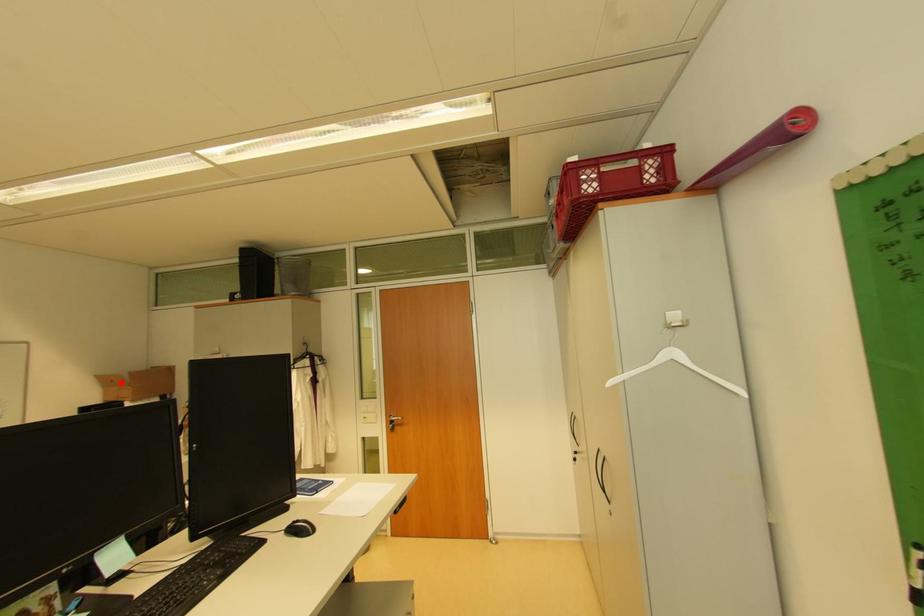
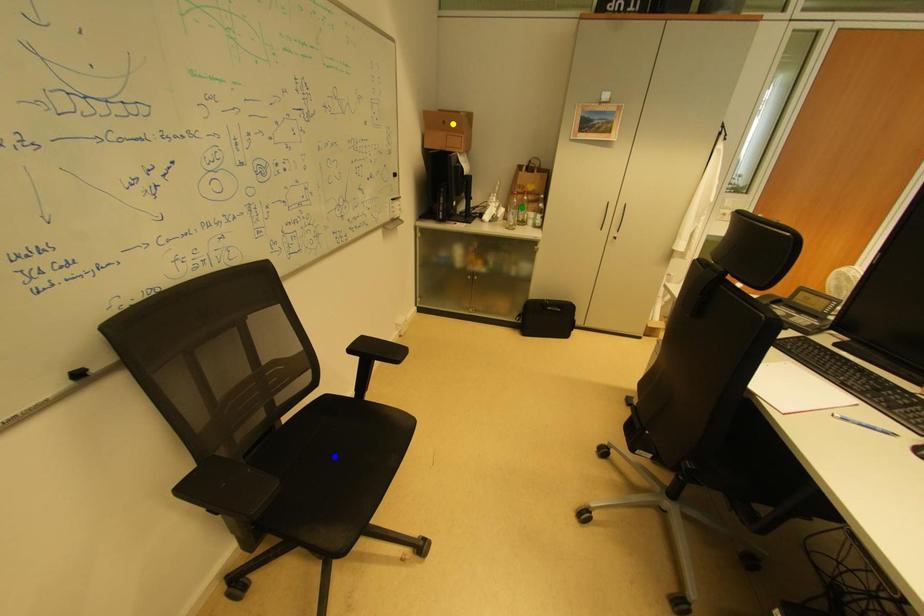
Question: I am providing you with two images of the same scene from different viewpoints. A red point is marked on the first image. You are given multiple points on the second image. Which spot in image 2 lines up with the point in image 1?

Choices:
 (A) yellow point
 (B) green point
 (C) blue point

Answer: (A)